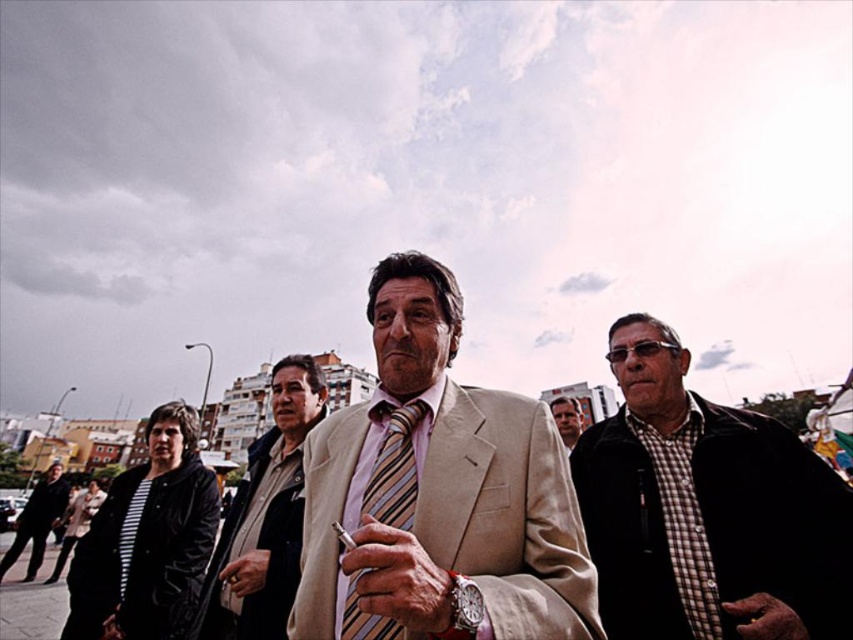
Question: Which point is farther from the camera taking this photo?

Choices:
 (A) (154, 573)
 (B) (648, 605)
 (C) (28, 522)

Answer: (C)

Question: Which object is positioned farthest from the striped fabric tie at center?

Choices:
 (A) light beige suit at center
 (B) beige fabric suit at center
 (C) black leather jacket at lower left
 (D) matte silver cigarette at center

Answer: (C)

Question: Can you confirm if beige textured suit at center is smaller than black leather jacket at lower left?

Choices:
 (A) no
 (B) yes

Answer: (B)

Question: Is beige textured suit at center positioned in front of striped fabric tie at center?

Choices:
 (A) no
 (B) yes

Answer: (A)

Question: Which of these objects is positioned farthest from the black leather jacket at lower left?

Choices:
 (A) light beige suit at center
 (B) beige textured suit at center
 (C) striped fabric tie at center
 (D) striped fabric jacket at center

Answer: (A)

Question: Can you confirm if checkered fabric shirt at center is bigger than black leather jacket at lower left?

Choices:
 (A) no
 (B) yes

Answer: (A)